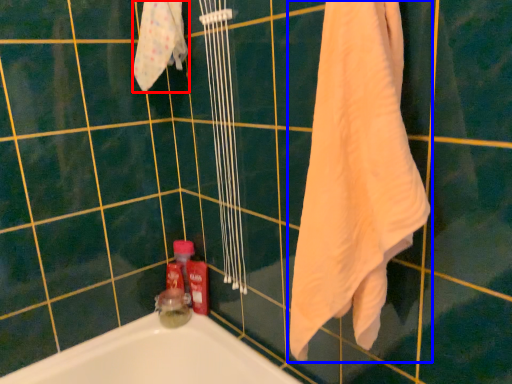
Question: Which point is further to the camera, bath towel (highlighted by a red box) or towel (highlighted by a blue box)?

Choices:
 (A) bath towel
 (B) towel

Answer: (A)